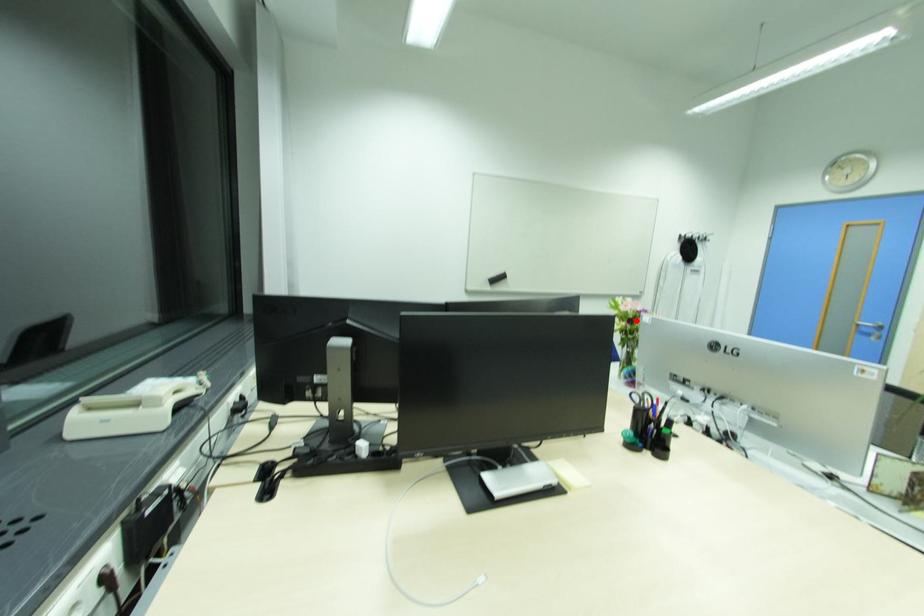
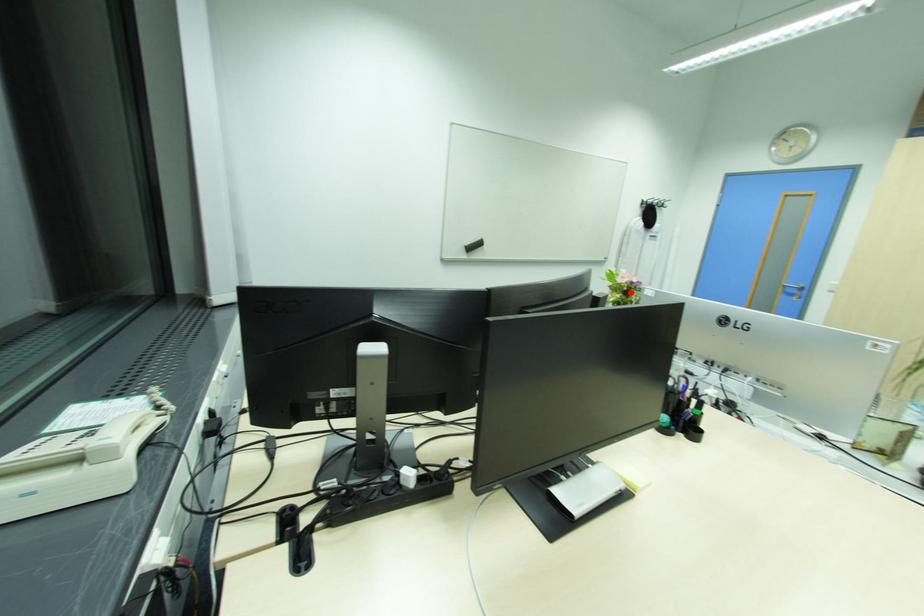
I am providing you with two images of the same scene from different viewpoints. A red point is marked on the first image and another point is marked on the second image. Does the point marked in image1 correspond to the same location as the one in image2?

Yes